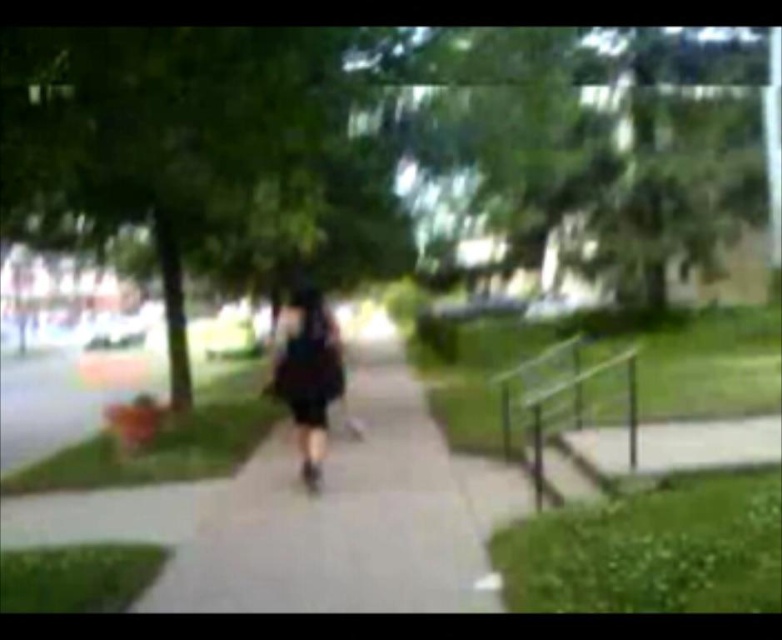
Question: Among these points, which one is farthest from the camera?

Choices:
 (A) (273, 577)
 (B) (303, 360)
 (C) (540, 474)

Answer: (B)

Question: Which point is farther to the camera?

Choices:
 (A) (547, 397)
 (B) (318, 384)

Answer: (A)

Question: Is gray concrete sidewalk at center smaller than black matte dress at center?

Choices:
 (A) yes
 (B) no

Answer: (B)

Question: Can you confirm if gray concrete sidewalk at center is positioned to the left of black matte dress at center?

Choices:
 (A) no
 (B) yes

Answer: (A)

Question: Is gray concrete sidewalk at center below black matte dress at center?

Choices:
 (A) no
 (B) yes

Answer: (B)

Question: Which point is farther to the camera?

Choices:
 (A) (316, 291)
 (B) (433, 548)
 (C) (504, 445)

Answer: (C)